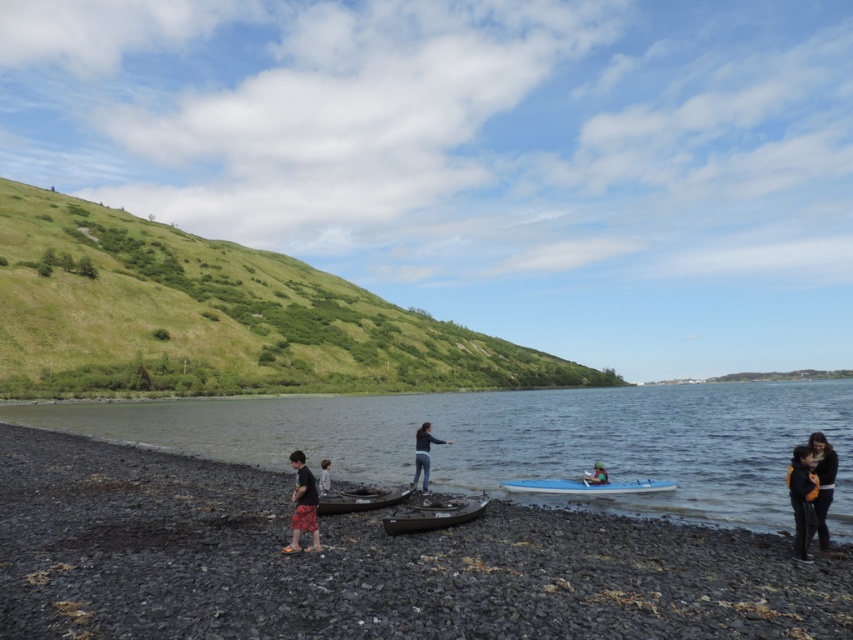
Question: Can you confirm if smooth pebbles beach at lower left is positioned above light brown hair at lower center?

Choices:
 (A) yes
 (B) no

Answer: (A)

Question: Is smooth pebbles beach at lower left wider than clear water at lower left?

Choices:
 (A) no
 (B) yes

Answer: (A)

Question: Which point is closer to the camera?

Choices:
 (A) (637, 481)
 (B) (587, 484)

Answer: (B)

Question: Which of the following is the farthest from the observer?

Choices:
 (A) clear water at lower left
 (B) blue glossy surfboard at center
 (C) light brown hair at lower center

Answer: (B)

Question: Is smooth pebbles beach at lower left further to the viewer compared to blue plastic paddle at lower center?

Choices:
 (A) no
 (B) yes

Answer: (A)

Question: Which is farther from the dark brown leather jacket at lower right?

Choices:
 (A) orange life vest at lower right
 (B) red plaid shorts at lower left
 (C) clear water at lower left

Answer: (C)